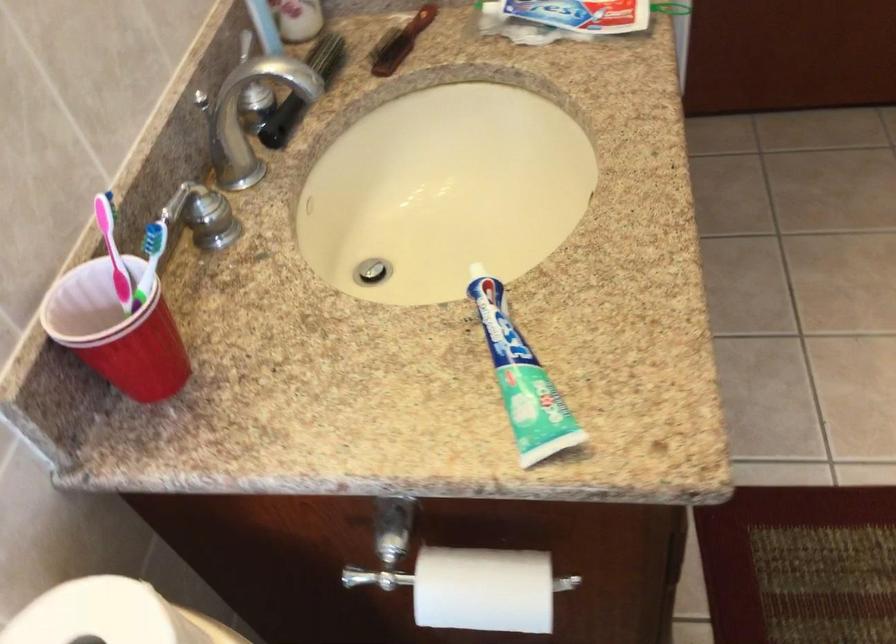
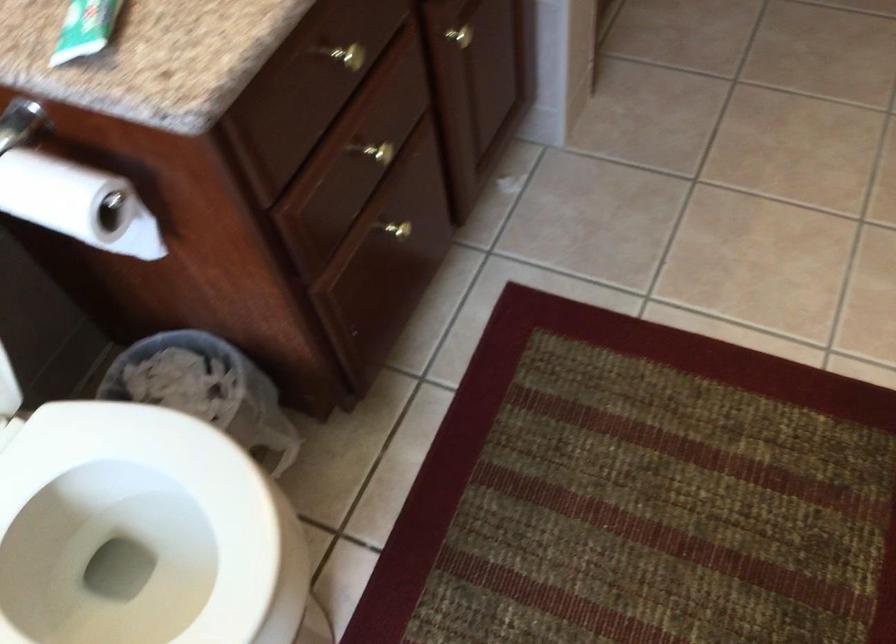
Question: How did the camera likely rotate?

Choices:
 (A) Left
 (B) Right
 (C) Up
 (D) Down

Answer: (D)